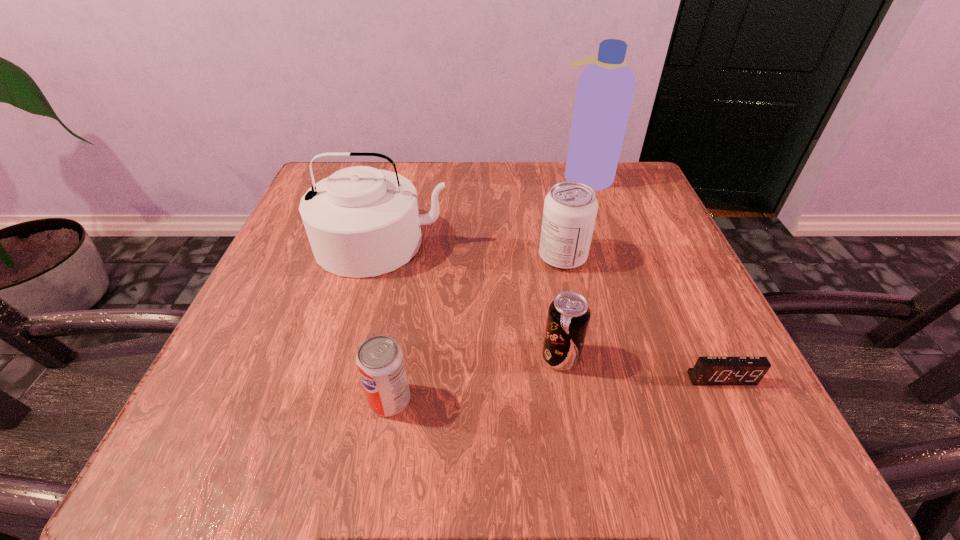
The width and height of the screenshot is (960, 540). I want to click on object that is at the far left corner, so click(x=361, y=221).

Identify the location of object positioned at the far right corner. The width and height of the screenshot is (960, 540). (605, 89).

The width and height of the screenshot is (960, 540). In the image, there is a desktop. Find the location of `vacant space at the far edge`. vacant space at the far edge is located at coordinates (538, 193).

Identify the location of free space at the left edge of the desktop. (264, 325).

Identify the location of free space at the right edge of the desktop. The height and width of the screenshot is (540, 960). tap(719, 329).

The image size is (960, 540). In the image, there is a desktop. What are the coordinates of `vacant space at the far left corner` in the screenshot? It's located at (362, 160).

What are the coordinates of `vacant area at the far right corner of the desktop` in the screenshot? It's located at coord(621,181).

The image size is (960, 540). I want to click on blank region between the second farthest soda and the kettle, so click(471, 300).

At what (x,y) coordinates should I click in order to perform the action: click on vacant space that's between the kettle and the farthest soda. Please return your answer as a coordinate pair (x, y). This screenshot has width=960, height=540. Looking at the image, I should click on (472, 249).

Find the location of `unoccupied position between the farthest soda and the leftmost soda`. unoccupied position between the farthest soda and the leftmost soda is located at coordinates (476, 328).